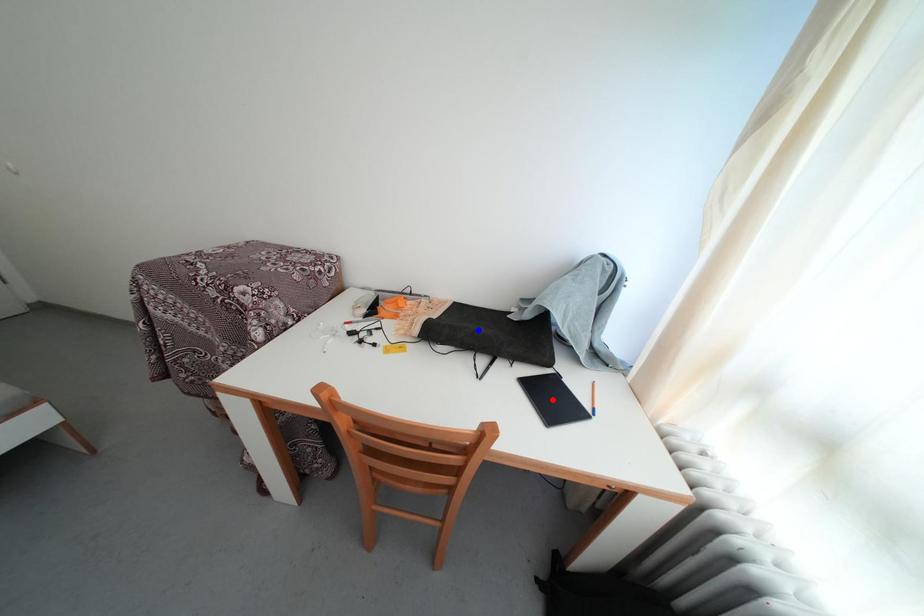
Question: Two points are marked on the image. Which point is closer to the camera?

Choices:
 (A) Blue point is closer.
 (B) Red point is closer.

Answer: (B)